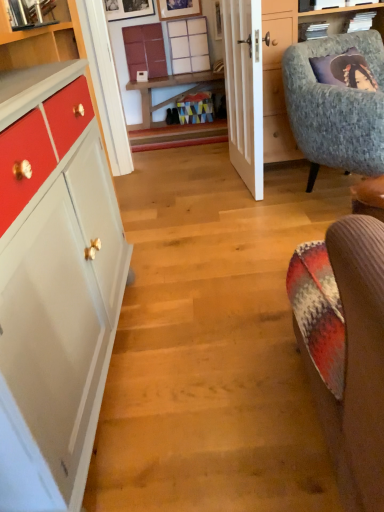
Find the location of a particular element. This screenshot has width=384, height=512. white grid shelf at upper center is located at coordinates (189, 45).

The width and height of the screenshot is (384, 512). What do you see at coordinates (174, 95) in the screenshot? I see `wooden table at center` at bounding box center [174, 95].

What do you see at coordinates (244, 90) in the screenshot? The image size is (384, 512). I see `white wooden door at center` at bounding box center [244, 90].

Describe the element at coordinates (128, 9) in the screenshot. I see `wooden picture frame at upper center, which is the first picture frame in left-to-right order` at that location.

This screenshot has width=384, height=512. Identify the location of matte wood cabinet at upper center. (145, 50).

What do you see at coordinates (145, 50) in the screenshot? The height and width of the screenshot is (512, 384). I see `matte wood cabinet at upper center` at bounding box center [145, 50].

Where is `white grid shelf at upper center`? Image resolution: width=384 pixels, height=512 pixels. white grid shelf at upper center is located at coordinates (189, 45).

You are a GUI agent. You are given a task and a screenshot of the screen. Output one action in this format:
    pyautogui.click(x=<x>, y=<y>)
    Task: Click on the shelf behind the wooden table at center
    This screenshot has height=512, width=384.
    Given the screenshot: What is the action you would take?
    pyautogui.click(x=189, y=45)

Does white grid shelf at upper center turn towards wooden table at center?

No, white grid shelf at upper center is not turned towards wooden table at center.

Which is less distant, (206, 65) or (210, 70)?

The point (206, 65) is closer.

Which is correct: white grid shelf at upper center is inside wooden picture frame at upper center, arranged as the second picture frame when viewed from the right, or outside of it?

white grid shelf at upper center is spatially situated outside wooden picture frame at upper center, arranged as the second picture frame when viewed from the right.

From their relative heights in the image, would you say white grid shelf at upper center is taller or shorter than wooden picture frame at upper center, which is the first picture frame in left-to-right order?

Considering their sizes, white grid shelf at upper center has more height than wooden picture frame at upper center, which is the first picture frame in left-to-right order.

Who is smaller, white grid shelf at upper center or wooden picture frame at upper center, which is the first picture frame in left-to-right order?

Smaller between the two is wooden picture frame at upper center, which is the first picture frame in left-to-right order.

Consider the image. Which is more to the right, matte wood cabinet at upper center or white grid shelf at upper center?

Positioned to the right is white grid shelf at upper center.

Which is in front, point (144, 34) or point (200, 34)?

The point (144, 34) is closer.

Is matte wood cabinet at upper center positioned behind white grid shelf at upper center?

That is True.

Could white grid shelf at upper center be considered to be inside matte wood cabinet at upper center?

No, white grid shelf at upper center is located outside of matte wood cabinet at upper center.

Looking at the image, does textured gray armchair at upper right seem bigger or smaller compared to matte wooden picture frame at upper center, which ranks as the first picture frame in right-to-left order?

Considering their sizes, textured gray armchair at upper right takes up more space than matte wooden picture frame at upper center, which ranks as the first picture frame in right-to-left order.

Considering the relative sizes of textured gray armchair at upper right and matte wooden picture frame at upper center, which ranks as the first picture frame in right-to-left order, in the image provided, is textured gray armchair at upper right thinner than matte wooden picture frame at upper center, which ranks as the first picture frame in right-to-left order,?

No.

Could you tell me if textured gray armchair at upper right is turned towards matte wooden picture frame at upper center, the second picture frame positioned from the left?

No, textured gray armchair at upper right does not turn towards matte wooden picture frame at upper center, the second picture frame positioned from the left.

In the scene shown: Which is correct: textured gray armchair at upper right is inside matte wooden picture frame at upper center, the second picture frame positioned from the left, or outside of it?

textured gray armchair at upper right is outside matte wooden picture frame at upper center, the second picture frame positioned from the left.

Is wooden table at center far away from white grid shelf at upper center?

Actually, wooden table at center and white grid shelf at upper center are a little close together.

From the image's perspective, is wooden table at center positioned above or below white grid shelf at upper center?

wooden table at center is below white grid shelf at upper center.

What are the coordinates of `shelf behind the wooden table at center` in the screenshot? It's located at (189, 45).

Does point (136, 85) appear closer or farther from the camera than point (176, 27)?

Point (136, 85) is farther from the camera than point (176, 27).

Is point (166, 79) behind point (158, 10)?

Yes.

How different are the orientations of wooden table at center and matte wooden picture frame at upper center, the second picture frame positioned from the left, in degrees?

There is a 0.00499-degree angle between the facing directions of wooden table at center and matte wooden picture frame at upper center, the second picture frame positioned from the left.

Is wooden table at center bigger than matte wooden picture frame at upper center, which ranks as the first picture frame in right-to-left order?

Indeed, wooden table at center has a larger size compared to matte wooden picture frame at upper center, which ranks as the first picture frame in right-to-left order.

In the scene shown: How much distance is there between wooden table at center and matte wooden picture frame at upper center, which ranks as the first picture frame in right-to-left order?

wooden table at center and matte wooden picture frame at upper center, which ranks as the first picture frame in right-to-left order, are 27.56 inches apart.

At what (x,y) coordinates should I click in order to perform the action: click on door above the textured gray armchair at upper right (from the image's perspective). Please return your answer as a coordinate pair (x, y). The height and width of the screenshot is (512, 384). Looking at the image, I should click on (244, 90).

Is white wooden door at center outside of textured gray armchair at upper right?

Yes.

Considering the points (259, 197) and (328, 110), which point is in front, point (259, 197) or point (328, 110)?

The point (328, 110) is in front.

At what (x,y) coordinates should I click in order to perform the action: click on shelf lying behind the wooden table at center. Please return your answer as a coordinate pair (x, y). Looking at the image, I should click on click(189, 45).

Identify the location of picture frame that is the 2nd object to the left of the white grid shelf at upper center, starting at the anchor. This screenshot has width=384, height=512. (128, 9).

Consider the image. When comparing their distances from white wooden door at center, does matte wood counter top at upper left or matte wooden picture frame at upper center, which ranks as the first picture frame in right-to-left order, seem closer?

matte wood counter top at upper left.

Considering their positions, is white wooden door at center positioned further to matte wooden picture frame at upper center, which ranks as the first picture frame in right-to-left order, than matte wood counter top at upper left?

Based on the image, matte wood counter top at upper left appears to be further to matte wooden picture frame at upper center, which ranks as the first picture frame in right-to-left order.

When comparing their distances from matte wooden picture frame at upper center, which ranks as the first picture frame in right-to-left order, does matte wood counter top at upper left or white wooden door at center seem further?

matte wood counter top at upper left is further to matte wooden picture frame at upper center, which ranks as the first picture frame in right-to-left order.

Looking at the image, which one is located closer to matte wood counter top at upper left, matte wooden picture frame at upper center, which ranks as the first picture frame in right-to-left order, or textured gray armchair at upper right?

textured gray armchair at upper right.

Looking at the image, which one is located closer to white grid shelf at upper center, wooden picture frame at upper center, which is the first picture frame in left-to-right order, or matte wooden picture frame at upper center, the second picture frame positioned from the left?

Among the two, matte wooden picture frame at upper center, the second picture frame positioned from the left, is located nearer to white grid shelf at upper center.

Looking at the image, which one is located closer to matte wood cabinet at upper center, matte wooden picture frame at upper center, the second picture frame positioned from the left, or white grid shelf at upper center?

white grid shelf at upper center.

Looking at this image, when comparing their distances from wooden picture frame at upper center, arranged as the second picture frame when viewed from the right, does matte wood cabinet at upper center or white grid shelf at upper center seem further?

The object further to wooden picture frame at upper center, arranged as the second picture frame when viewed from the right, is white grid shelf at upper center.

From the picture: From the image, which object appears to be nearer to white grid shelf at upper center, matte wood cabinet at upper center or matte wooden picture frame at upper center, which ranks as the first picture frame in right-to-left order?

matte wooden picture frame at upper center, which ranks as the first picture frame in right-to-left order, lies closer to white grid shelf at upper center than the other object.

Locate an element on the screen. The width and height of the screenshot is (384, 512). door between matte wood counter top at upper left and matte wooden picture frame at upper center, which ranks as the first picture frame in right-to-left order, from front to back is located at coordinates (244, 90).

Where is `picture frame between white wooden door at center and wooden picture frame at upper center, which is the first picture frame in left-to-right order, along the z-axis`? The image size is (384, 512). picture frame between white wooden door at center and wooden picture frame at upper center, which is the first picture frame in left-to-right order, along the z-axis is located at coordinates (178, 9).

Locate an element on the screen. This screenshot has width=384, height=512. cabinetry between matte wooden picture frame at upper center, which ranks as the first picture frame in right-to-left order, and wooden table at center vertically is located at coordinates (145, 50).

The width and height of the screenshot is (384, 512). What are the coordinates of `shelf between white wooden door at center and matte wood cabinet at upper center along the z-axis` in the screenshot? It's located at (189, 45).